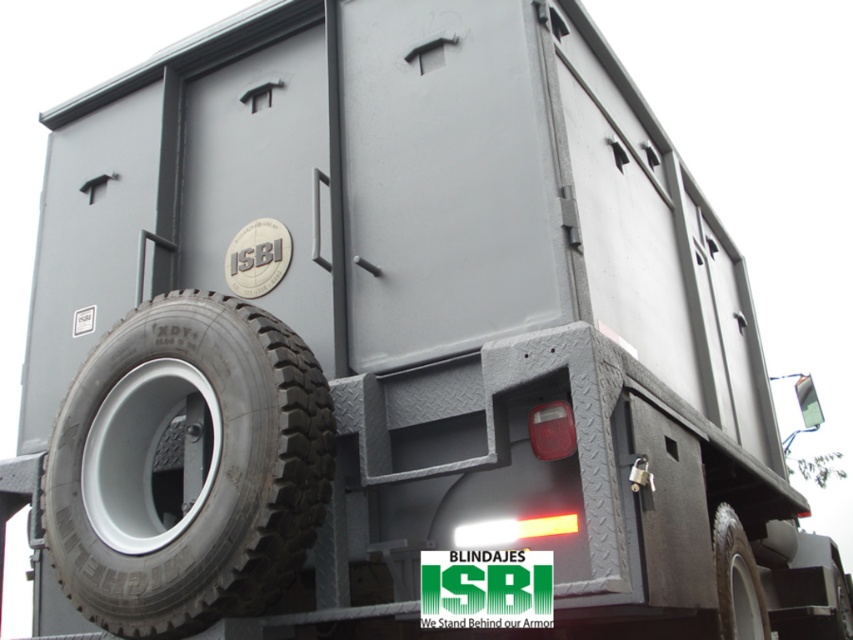
In the scene shown: How distant is black rubber tire at lower left from black rubber tire at lower right?

The distance of black rubber tire at lower left from black rubber tire at lower right is 6.65 feet.

Is black rubber tire at lower left smaller than black rubber tire at lower right?

No, black rubber tire at lower left is not smaller than black rubber tire at lower right.

Does point (236, 612) come farther from viewer compared to point (746, 584)?

No, it is in front of (746, 584).

This screenshot has width=853, height=640. In order to click on black rubber tire at lower left in this screenshot , I will do `click(187, 467)`.